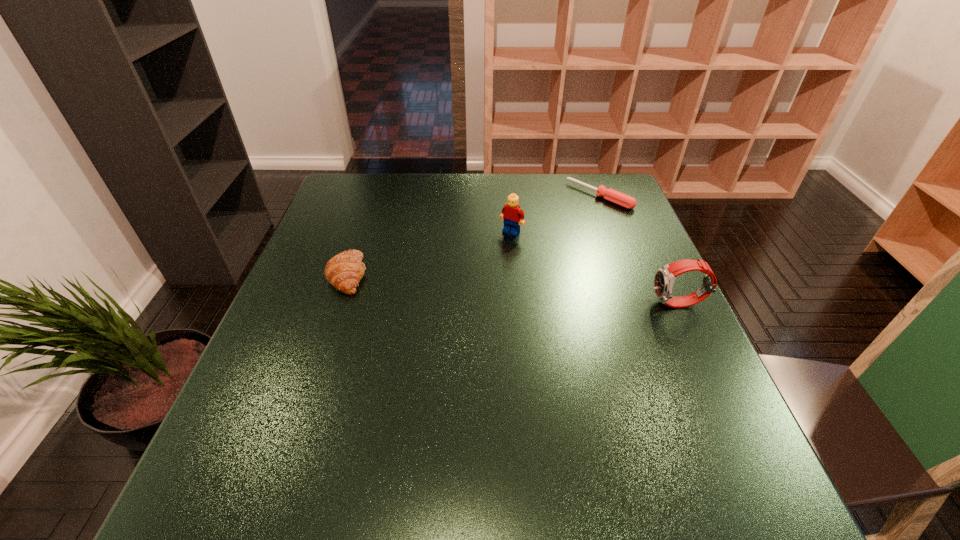
Locate an element on the screen. Image resolution: width=960 pixels, height=540 pixels. vacant region located on the face of the watch is located at coordinates (490, 304).

At what (x,y) coordinates should I click in order to perform the action: click on vacant space situated 0.080m at the tip of the screwdriver. Please return your answer as a coordinate pair (x, y). Looking at the image, I should click on (567, 218).

In order to click on blank space located at the tip of the screwdriver in this screenshot , I will do `click(503, 266)`.

What are the coordinates of `free spot located 0.330m at the tip of the screwdriver` in the screenshot? It's located at 514,259.

The height and width of the screenshot is (540, 960). I want to click on free location located on the front-facing side of the Lego, so click(x=447, y=304).

You are a GUI agent. You are given a task and a screenshot of the screen. Output one action in this format:
    pyautogui.click(x=<x>, y=<y>)
    Task: Click on the vacant space located on the front-facing side of the Lego
    
    Given the screenshot: What is the action you would take?
    pyautogui.click(x=490, y=254)

Where is `blank space located on the front-facing side of the Lego`? The height and width of the screenshot is (540, 960). blank space located on the front-facing side of the Lego is located at coordinates (422, 333).

Locate an element on the screen. The height and width of the screenshot is (540, 960). object that is positioned at the far edge is located at coordinates (621, 199).

The width and height of the screenshot is (960, 540). Identify the location of object that is at the left edge. (344, 271).

Locate an element on the screen. The width and height of the screenshot is (960, 540). watch located in the right edge section of the desktop is located at coordinates (664, 278).